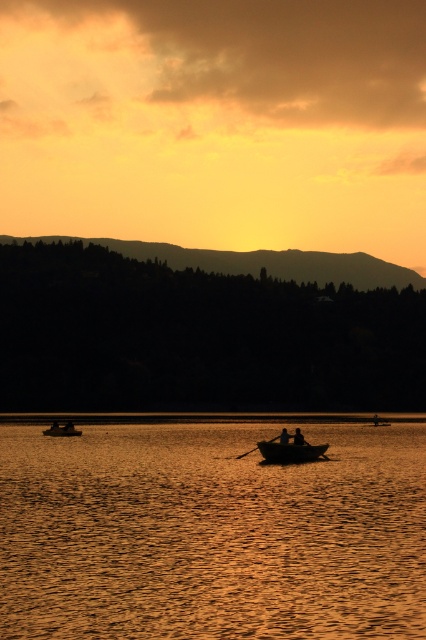
Is point (298, 444) less distant than point (63, 435)?

Yes, point (298, 444) is in front of point (63, 435).

Identify the location of smooth wooden canoe at center. The width and height of the screenshot is (426, 640). (290, 451).

Does smooth wooden boat at lower left appear on the right side of silhouette human at center?

In fact, smooth wooden boat at lower left is to the left of silhouette human at center.

Between smooth wooden boat at lower left and silhouette human at center, which one has more height?

smooth wooden boat at lower left is taller.

Who is more distant from viewer, (48, 432) or (298, 433)?

Point (48, 432)

Locate an element on the screen. This screenshot has height=640, width=426. smooth wooden boat at lower left is located at coordinates (62, 429).

Who is taller, silhouette human at center or smooth skin figure at center?

With more height is smooth skin figure at center.

Which is behind, point (296, 428) or point (281, 435)?

The point (296, 428) is behind.

I want to click on silhouette human at center, so click(x=299, y=436).